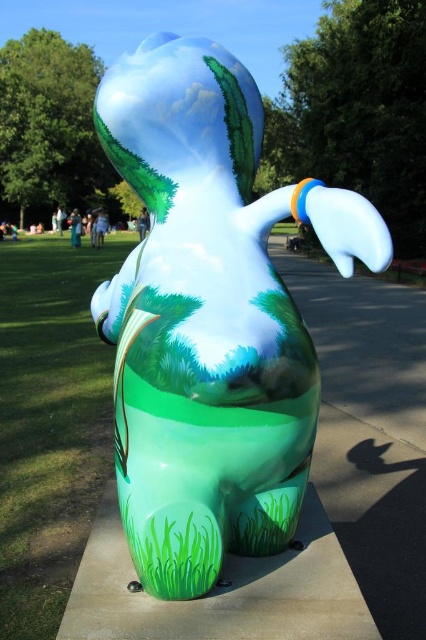
You are an artist planning to paint a mural inspired by the sculpture. You need to ensure the rabbit in your mural is proportionate to the grass in the background. According to the scene, how does the width of the glossy ceramic rabbit at center compare to the green matte grass at lower left?

The glossy ceramic rabbit at center has a lesser width compared to the green matte grass at lower left.

From the picture: You are an artist planning to paint a mural inspired by the sculpture. You want to ensure the glossy ceramic rabbit at center is proportionate to the green matte grass at lower left. Based on the scene, how should you size them in your painting?

The glossy ceramic rabbit at center is larger in size than the green matte grass at lower left, so in your painting, the glossy ceramic rabbit at center should be depicted as bigger than the green matte grass at lower left to maintain the correct proportions.

You are a park visitor who wants to take a photo of the glossy ceramic rabbit at center and the green matte grass at lower left. Which object should you focus on first if you want to capture both in one shot without moving the camera?

The glossy ceramic rabbit at center is above the green matte grass at lower left, so you should focus on the glossy ceramic rabbit at center first to ensure both are in frame.